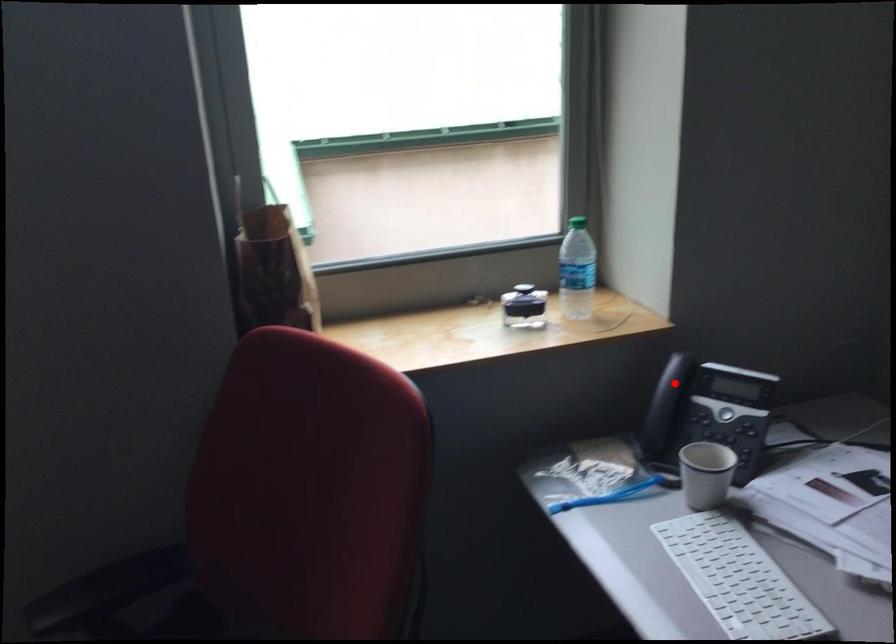
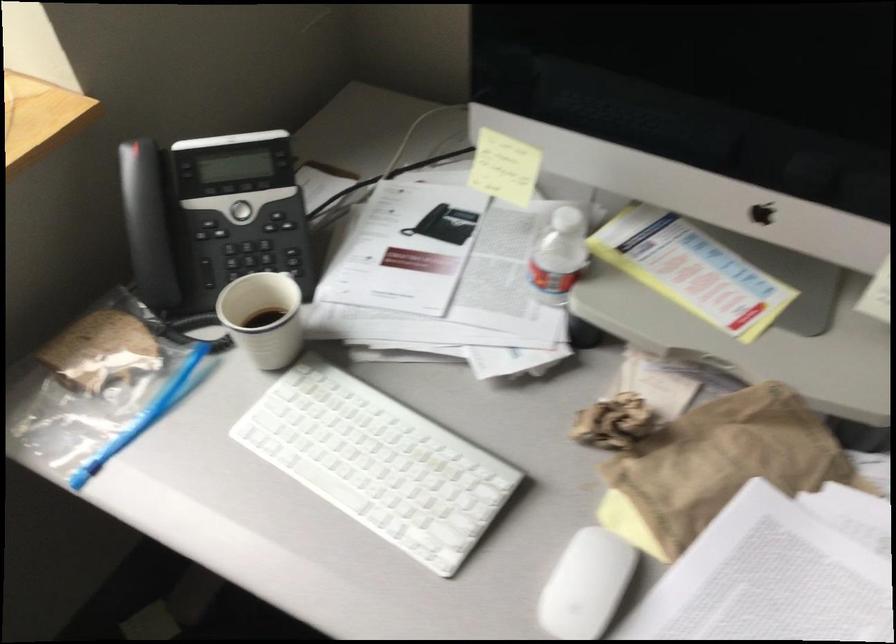
Question: A red point is marked in image1. In image2, is the corresponding 3D point closer to the camera or farther? Reply with the corresponding letter.

Choices:
 (A) The corresponding 3D point is closer.
 (B) The corresponding 3D point is farther.

Answer: (A)